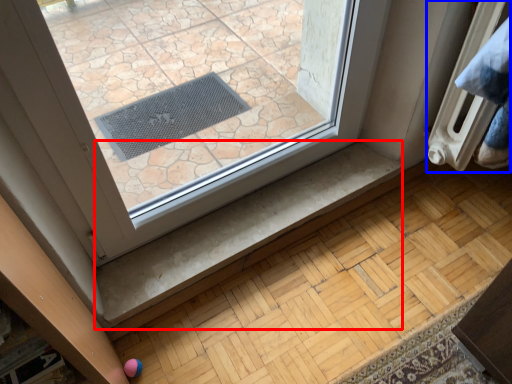
Question: Which point is closer to the camera, stair (highlighted by a red box) or radiator (highlighted by a blue box)?

Choices:
 (A) stair
 (B) radiator

Answer: (B)